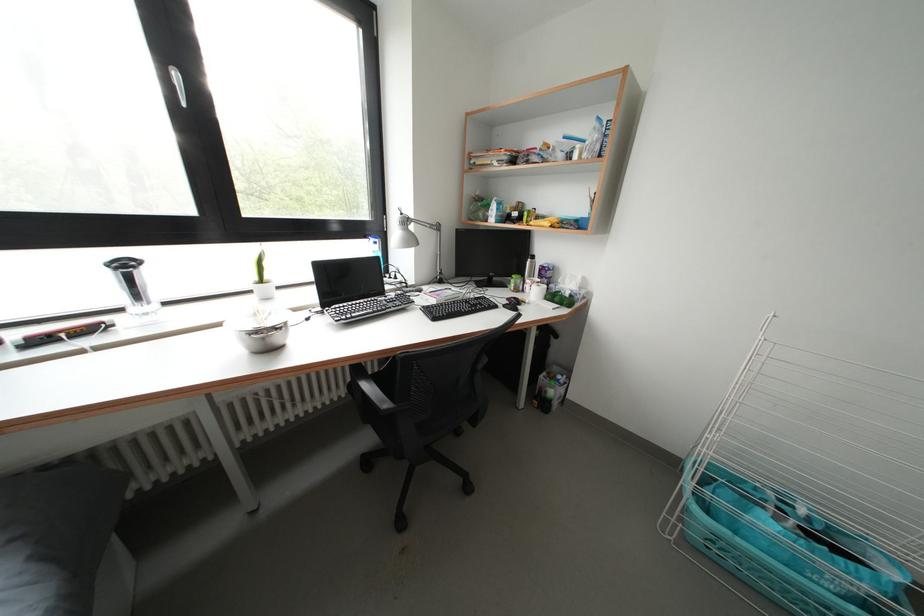
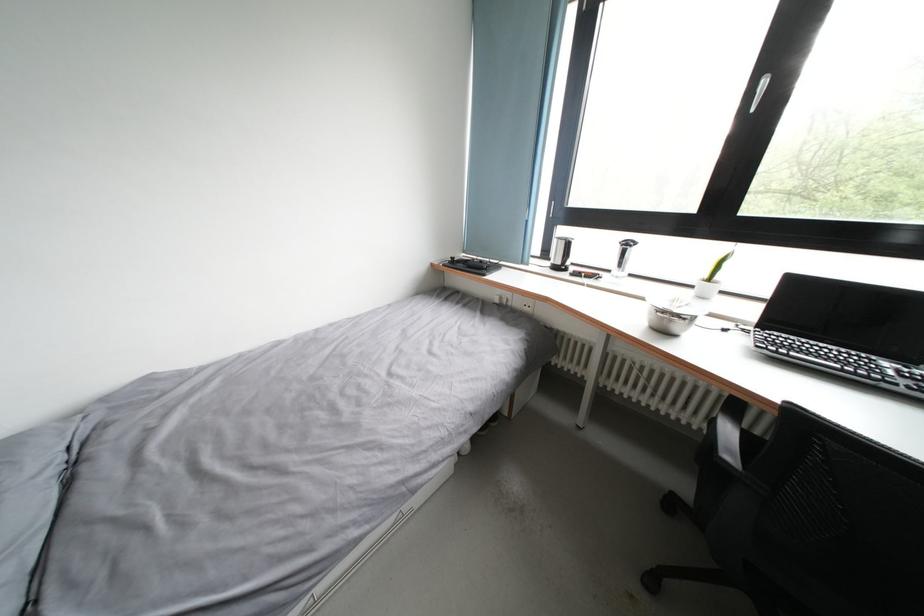
In the second image, find the point that corresponds to point 262,337 in the first image.

(670, 317)